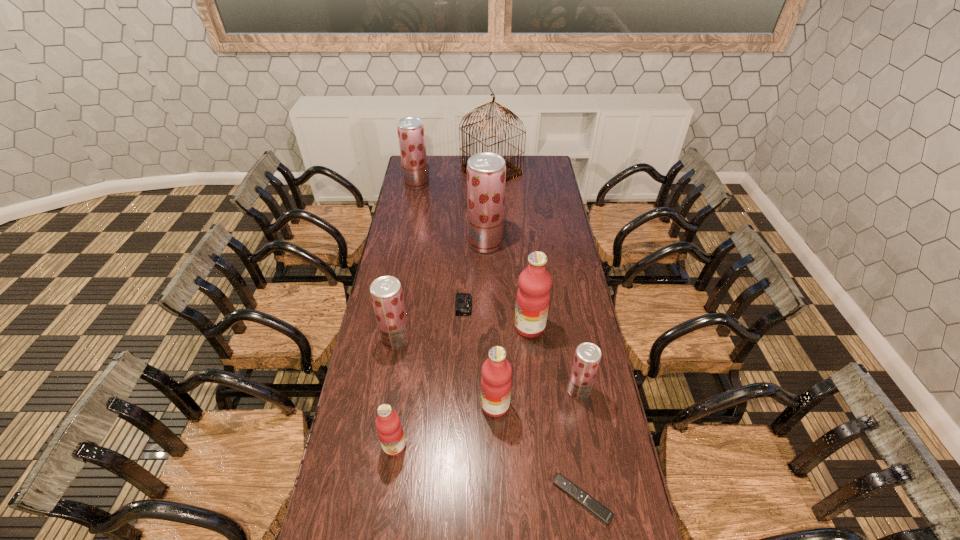
This screenshot has width=960, height=540. I want to click on vacant region located on the label of the biggest pink fruit juice, so click(x=418, y=327).

Where is `blank space located on the label of the biggest pink fruit juice`? This screenshot has width=960, height=540. blank space located on the label of the biggest pink fruit juice is located at coordinates (479, 327).

You are a GUI agent. You are given a task and a screenshot of the screen. Output one action in this format:
    pyautogui.click(x=<x>, y=<y>)
    Task: Click on the vacant space located on the label of the biggest pink fruit juice
    This screenshot has width=960, height=540.
    Given the screenshot: What is the action you would take?
    pyautogui.click(x=477, y=327)

You are a GUI agent. You are given a task and a screenshot of the screen. Output one action in this format:
    pyautogui.click(x=<x>, y=<y>)
    Task: Click on the free space located 0.260m on the back of the third biggest strawberry fruit juice
    The image size is (960, 540).
    Given the screenshot: What is the action you would take?
    pyautogui.click(x=406, y=283)

This screenshot has width=960, height=540. I want to click on vacant space located on the label of the second pink fruit juice from right to left, so click(x=432, y=405).

Where is `free region located 0.130m on the label of the second pink fruit juice from right to left`? Image resolution: width=960 pixels, height=540 pixels. free region located 0.130m on the label of the second pink fruit juice from right to left is located at coordinates (444, 405).

Locate an element on the screen. vacant region located on the label of the second pink fruit juice from right to left is located at coordinates (366, 405).

This screenshot has width=960, height=540. I want to click on free space located 0.370m on the back of the rightmost fruit juice, so click(564, 305).

Identify the location of vacant space located 0.180m on the label of the nearest fruit juice. The width and height of the screenshot is (960, 540). (384, 519).

The height and width of the screenshot is (540, 960). I want to click on free space located 0.060m on the display of the second shortest object, so click(487, 306).